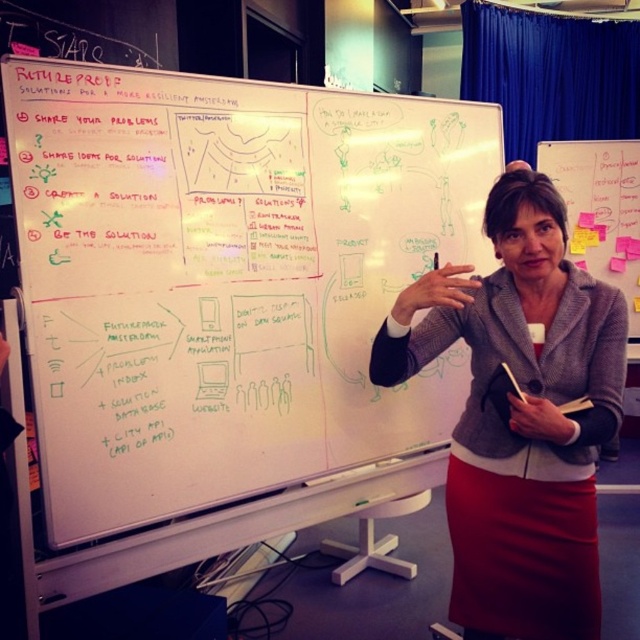
Is the position of whiteboard at upper center less distant than that of gray woolen blazer at center?

Yes, whiteboard at upper center is closer to the viewer.

Between whiteboard at upper center and gray woolen blazer at center, which one is positioned higher?

whiteboard at upper center is higher up.

Locate an element on the screen. Image resolution: width=640 pixels, height=640 pixels. whiteboard at upper center is located at coordinates (227, 278).